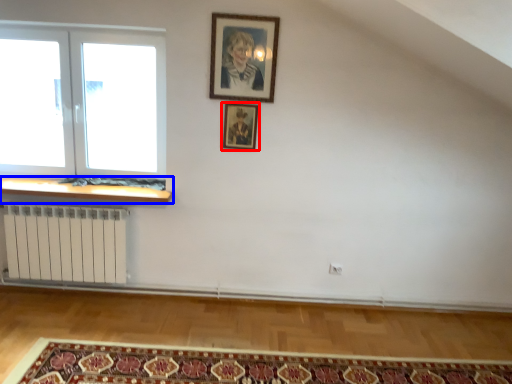
Question: Which object appears closest to the camera in this image, picture frame (highlighted by a red box) or window sill (highlighted by a blue box)?

Choices:
 (A) picture frame
 (B) window sill

Answer: (A)